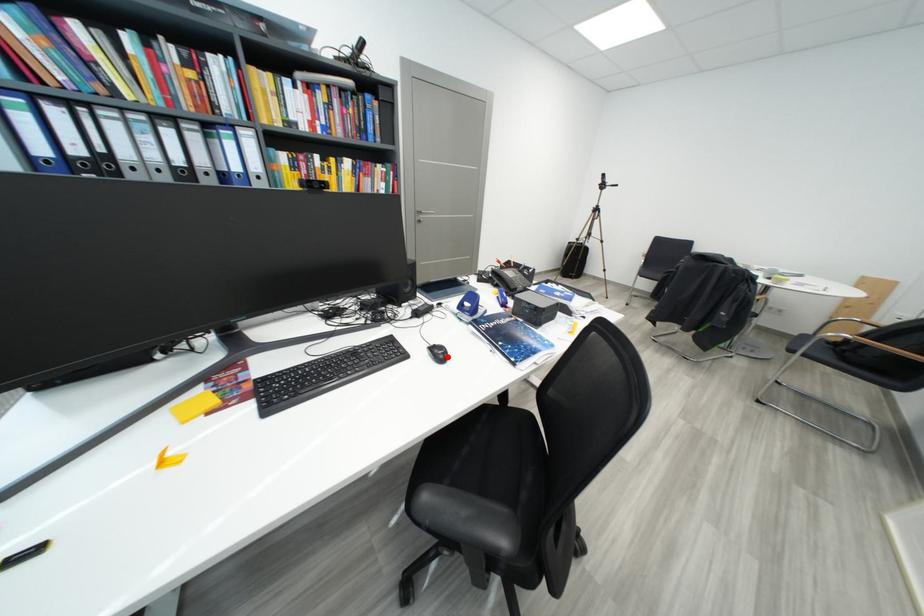
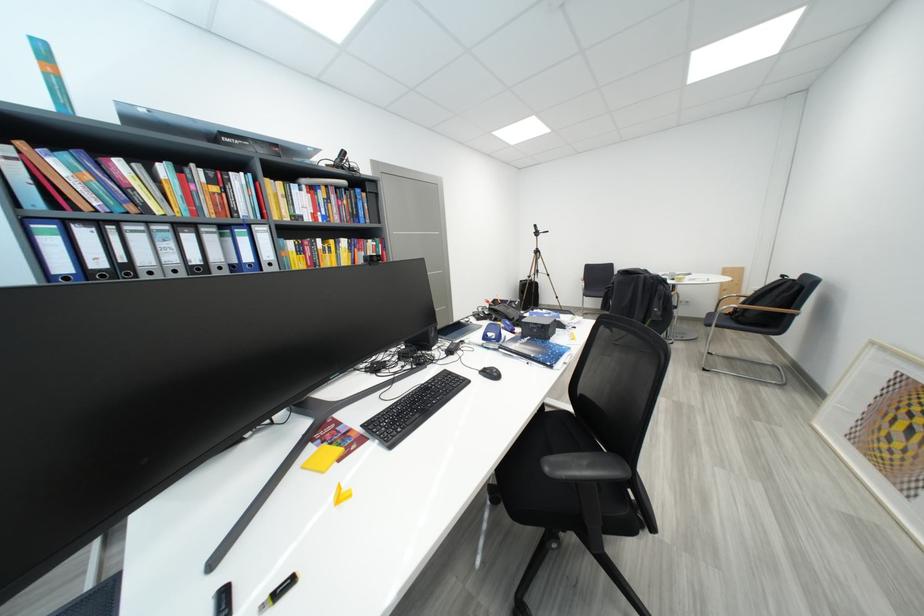
Find the pixel in the second image that matches the highlighted location in the first image.

(501, 377)